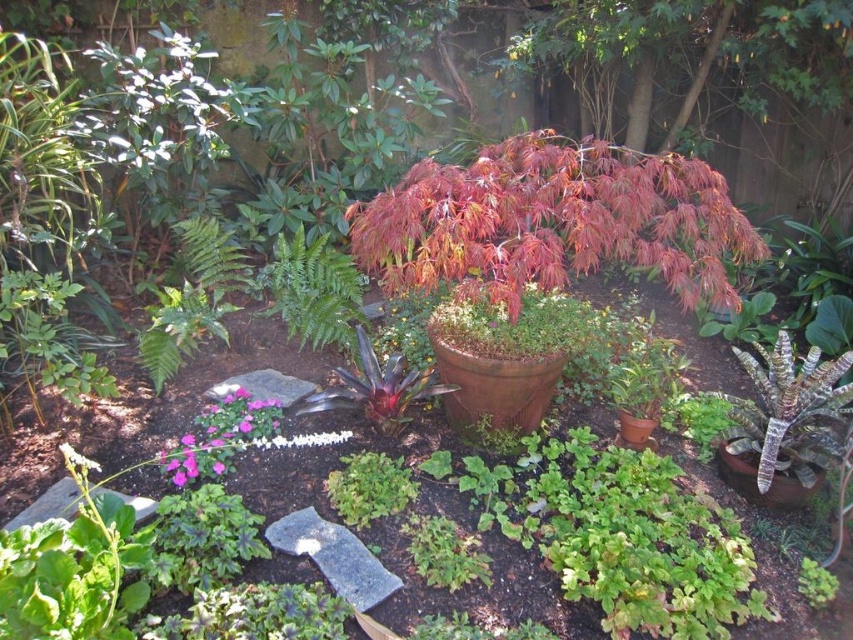
Question: Which of these objects is positioned farthest from the matte brown pot at center?

Choices:
 (A) green textured plant at lower right
 (B) pink matte flower at center

Answer: (B)

Question: Which point is closer to the camera?

Choices:
 (A) terracotta pot at center
 (B) pink matte flower at center

Answer: (B)

Question: Does shiny red maple at center have a larger size compared to matte brown pot at center?

Choices:
 (A) no
 (B) yes

Answer: (B)

Question: Which point is closer to the camera?

Choices:
 (A) (755, 493)
 (B) (630, 433)
 (C) (589, 182)
 (D) (450, 365)

Answer: (A)

Question: Is the position of terracotta pot at center less distant than that of pink matte flower at center?

Choices:
 (A) yes
 (B) no

Answer: (B)

Question: Where is pink matte flower at center located in relation to green textured plant at lower right in the image?

Choices:
 (A) above
 (B) below

Answer: (A)